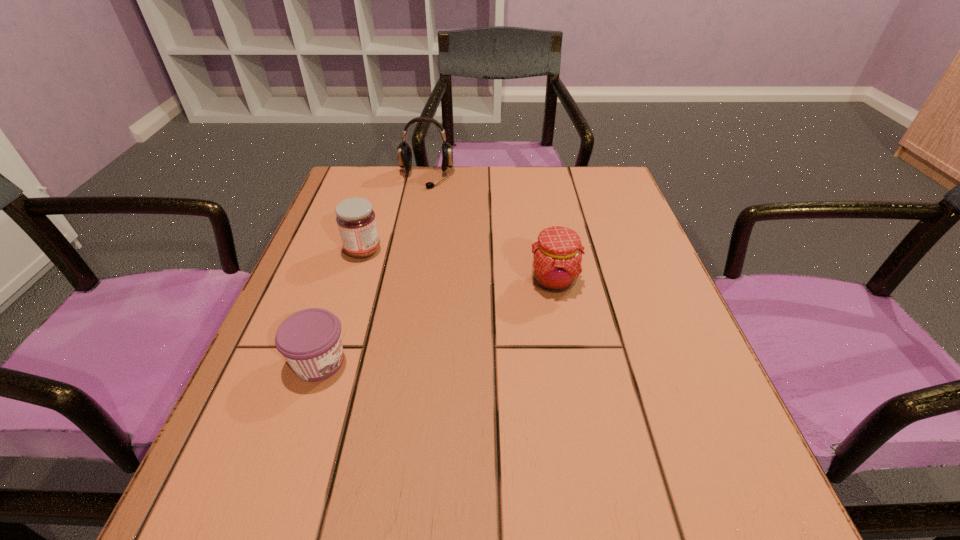
Locate an element on the screen. The image size is (960, 540). the tallest object is located at coordinates (404, 151).

Find the location of a particular element. the farthest object is located at coordinates (404, 151).

Where is `the third nearest object`? the third nearest object is located at coordinates (356, 220).

Where is `the second farthest jam`? This screenshot has height=540, width=960. the second farthest jam is located at coordinates [557, 255].

Locate an element on the screen. the third farthest object is located at coordinates (557, 255).

Where is `the nearest jam`? The image size is (960, 540). the nearest jam is located at coordinates (310, 340).

Where is `the shortest object`? the shortest object is located at coordinates (310, 340).

This screenshot has height=540, width=960. Identify the location of free spot located 0.150m with the microphone on the side of the tallest object. (418, 224).

Locate an element on the screen. The height and width of the screenshot is (540, 960). vacant space located 0.050m on the left of the third nearest object is located at coordinates (322, 251).

Where is `free region located 0.230m on the left of the rightmost jam`? The width and height of the screenshot is (960, 540). free region located 0.230m on the left of the rightmost jam is located at coordinates tap(413, 281).